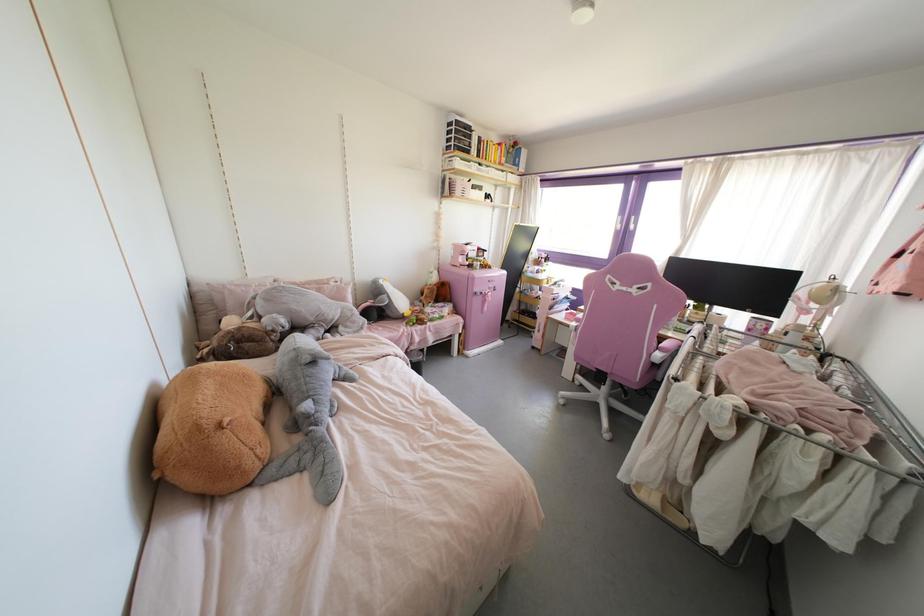
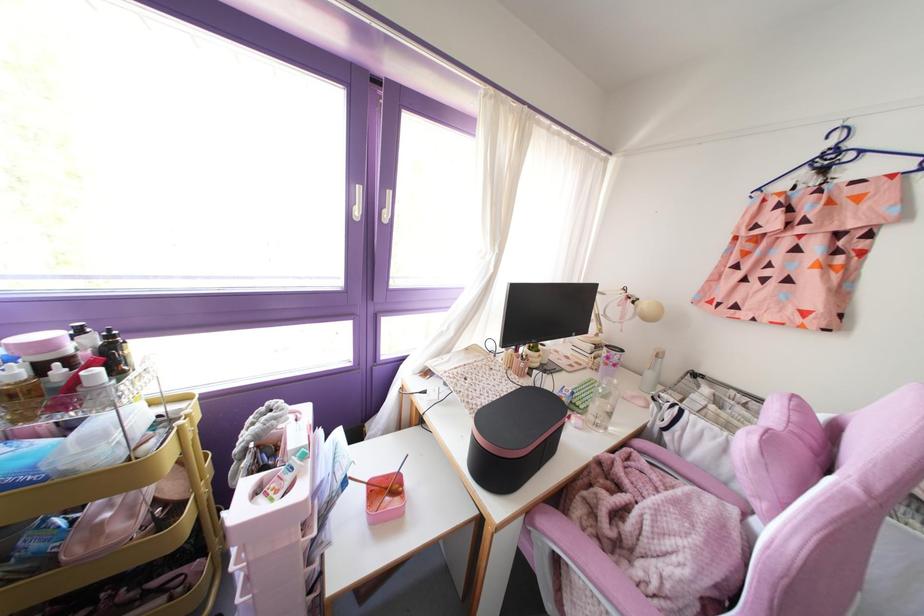
Locate, in the second image, the point that corresponds to (x=617, y=225) in the first image.

(357, 212)